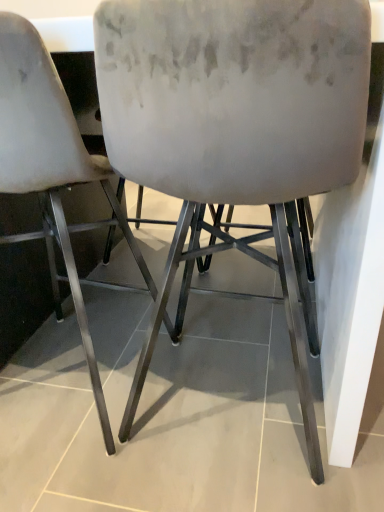
Question: From the image's perspective, is satin white chair at center, which appears as the 1th chair when viewed from the left, above or below velvet beige chair at center, which appears as the first chair when viewed from the right?

Choices:
 (A) above
 (B) below

Answer: (A)

Question: Is point (127, 224) positioned closer to the camera than point (117, 139)?

Choices:
 (A) farther
 (B) closer

Answer: (A)

Question: In the image, is satin white chair at center, placed as the 2th chair when sorted from right to left, positioned in front of or behind velvet beige chair at center, the second chair viewed from the left?

Choices:
 (A) front
 (B) behind

Answer: (B)

Question: Relative to satin white chair at center, which appears as the 1th chair when viewed from the left, is velvet beige chair at center, the second chair viewed from the left, in front or behind?

Choices:
 (A) behind
 (B) front

Answer: (B)

Question: Considering the positions of velvet beige chair at center, which appears as the first chair when viewed from the right, and satin white chair at center, which appears as the 1th chair when viewed from the left, in the image, is velvet beige chair at center, which appears as the first chair when viewed from the right, bigger or smaller than satin white chair at center, which appears as the 1th chair when viewed from the left,?

Choices:
 (A) small
 (B) big

Answer: (B)

Question: From their relative heights in the image, would you say velvet beige chair at center, the second chair viewed from the left, is taller or shorter than satin white chair at center, placed as the 2th chair when sorted from right to left?

Choices:
 (A) short
 (B) tall

Answer: (B)

Question: From a real-world perspective, is velvet beige chair at center, the second chair viewed from the left, physically located above or below satin white chair at center, placed as the 2th chair when sorted from right to left?

Choices:
 (A) below
 (B) above

Answer: (A)